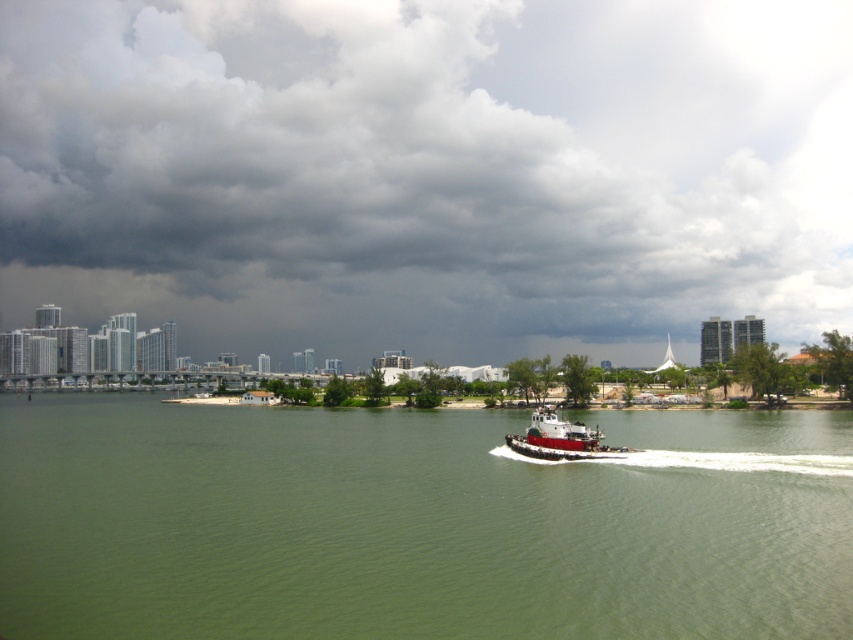
Who is shorter, dark gray cloud at upper center or green water at center?

green water at center

Which is below, dark gray cloud at upper center or green water at center?

green water at center

At what (x,y) coordinates should I click in order to perform the action: click on dark gray cloud at upper center. Please return your answer as a coordinate pair (x, y). Image resolution: width=853 pixels, height=640 pixels. Looking at the image, I should click on (428, 173).

This screenshot has width=853, height=640. What do you see at coordinates (428, 173) in the screenshot?
I see `dark gray cloud at upper center` at bounding box center [428, 173].

Where is `dark gray cloud at upper center`? dark gray cloud at upper center is located at coordinates (428, 173).

Between green water at center and white rubber boat at center, which one appears on the right side from the viewer's perspective?

From the viewer's perspective, white rubber boat at center appears more on the right side.

Is the position of green water at center more distant than that of white rubber boat at center?

No, green water at center is closer to the viewer.

Who is more distant from viewer, (724, 458) or (589, 440)?

Positioned behind is point (589, 440).

Locate an element on the screen. The height and width of the screenshot is (640, 853). green water at center is located at coordinates (416, 524).